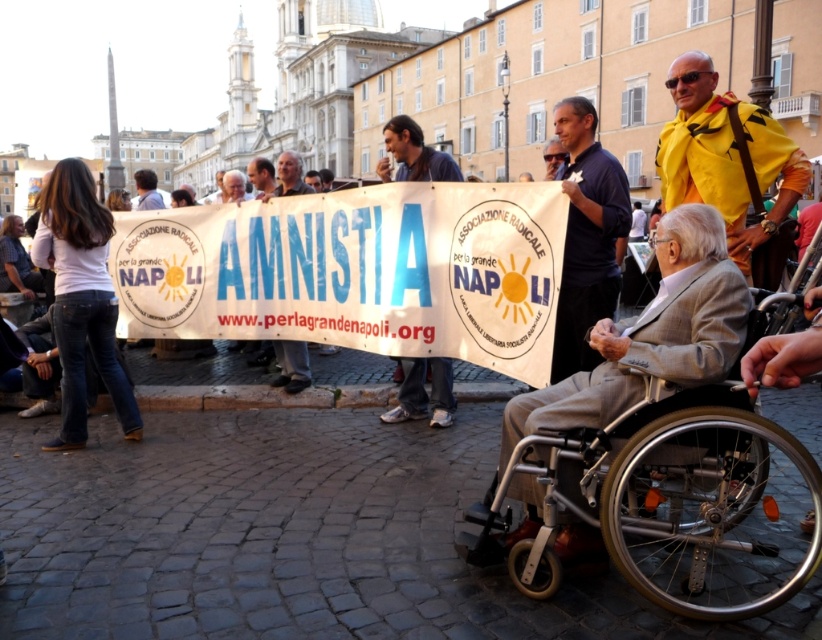
Describe the element at coordinates (670, 500) in the screenshot. I see `silver metallic wheelchair at lower right` at that location.

Does silver metallic wheelchair at lower right have a lesser width compared to yellow fabric jacket at upper right?

In fact, silver metallic wheelchair at lower right might be wider than yellow fabric jacket at upper right.

This screenshot has width=822, height=640. Identify the location of silver metallic wheelchair at lower right. (670, 500).

Locate an element on the screen. This screenshot has width=822, height=640. silver metallic wheelchair at lower right is located at coordinates (670, 500).

Is blue jeans at center thinner than matte yellow jacket at center?

Correct, blue jeans at center's width is less than matte yellow jacket at center's.

Which is behind, point (400, 403) or point (561, 145)?

The point (561, 145) is behind.

Between point (423, 387) and point (545, 170), which one is positioned behind?

The point (545, 170) is behind.

Where is `blue jeans at center`? blue jeans at center is located at coordinates (423, 392).

Is silver metallic wheelchair at lower right taller than matte black sign at center?

No, silver metallic wheelchair at lower right is not taller than matte black sign at center.

Measure the distance between silver metallic wheelchair at lower right and camera.

silver metallic wheelchair at lower right and camera are 90.12 feet apart from each other.

Between point (762, 531) and point (285, 195), which one is positioned in front?

Positioned in front is point (762, 531).

Identify the location of silver metallic wheelchair at lower right. This screenshot has height=640, width=822. 670,500.